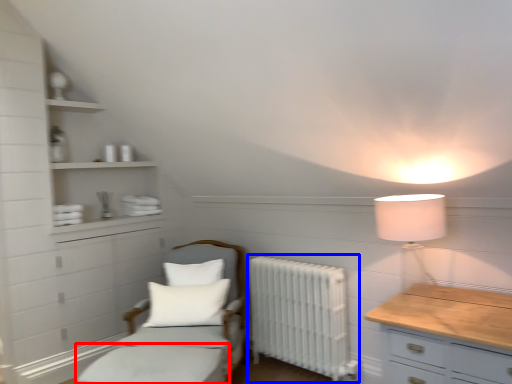
Question: Which object is further to the camera taking this photo, bed frame (highlighted by a red box) or radiator (highlighted by a blue box)?

Choices:
 (A) bed frame
 (B) radiator

Answer: (B)